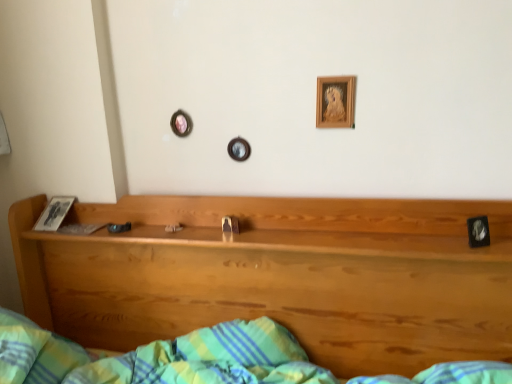
Question: From a real-world perspective, is black glossy picture frame at right, acting as the 2th picture frame starting from the back, physically located above or below wooden picture frame at upper center, the 1th picture frame positioned from the back?

Choices:
 (A) above
 (B) below

Answer: (B)

Question: Looking at their shapes, would you say black glossy picture frame at right, acting as the 2th picture frame starting from the back, is wider or thinner than wooden picture frame at upper center, arranged as the second picture frame when viewed from the right?

Choices:
 (A) thin
 (B) wide

Answer: (B)

Question: Which is nearer to the wooden headboard at center?

Choices:
 (A) black glossy picture frame at right, positioned as the first picture frame in front-to-back order
 (B) wooden picture frame at upper center, the 1th picture frame when ordered from left to right

Answer: (B)

Question: Estimate the real-world distances between objects in this image. Which object is closer to the wooden headboard at center?

Choices:
 (A) black glossy picture frame at right, positioned as the first picture frame in front-to-back order
 (B) wooden picture frame at upper center, arranged as the second picture frame when viewed from the right

Answer: (B)